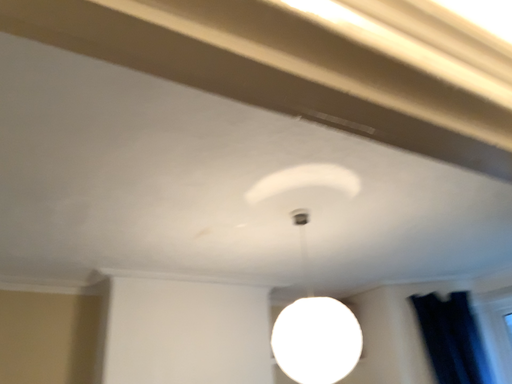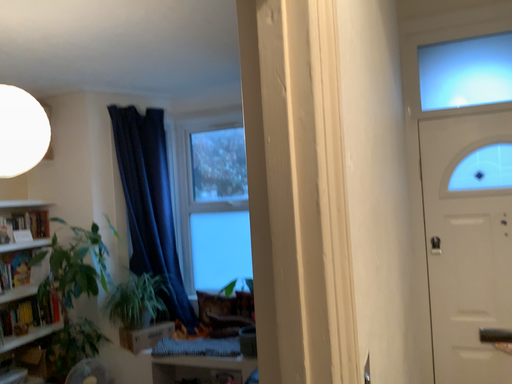
Question: Which way did the camera rotate in the video?

Choices:
 (A) rotated upward
 (B) rotated downward

Answer: (B)